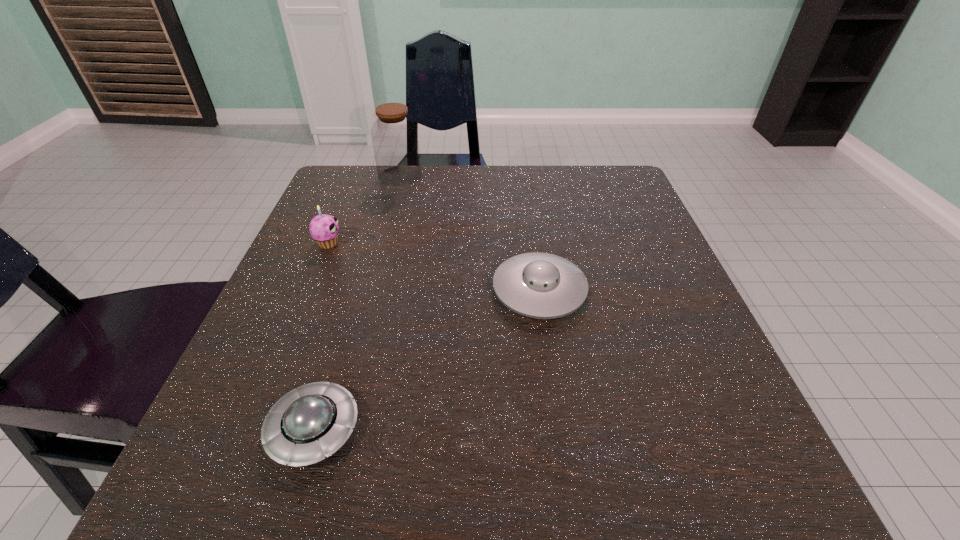
Locate an element on the screen. The height and width of the screenshot is (540, 960). the farthest object is located at coordinates (394, 136).

Identify the location of jar. 394,136.

Image resolution: width=960 pixels, height=540 pixels. I want to click on cupcake, so click(324, 229).

The height and width of the screenshot is (540, 960). In order to click on the second farthest object in this screenshot , I will do `click(324, 229)`.

This screenshot has width=960, height=540. Find the location of `the second nearest object`. the second nearest object is located at coordinates (538, 285).

Locate an element on the screen. the rightmost object is located at coordinates (538, 285).

The image size is (960, 540). I want to click on the nearer saucer, so click(307, 424).

Find the location of a particular element. the left saucer is located at coordinates (307, 424).

The height and width of the screenshot is (540, 960). What are the coordinates of `vacant space located on the right of the jar` in the screenshot? It's located at (506, 176).

Locate an element on the screen. The image size is (960, 540). vacant space located 0.190m on the face of the cupcake is located at coordinates (436, 243).